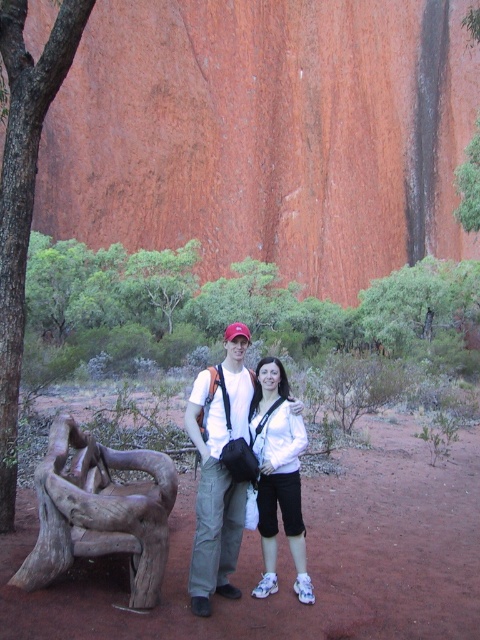
You are planning to take a photo of the smooth bark tree trunk at left and the white matte shirt at center. Which object should be placed closer to the camera to ensure both are in focus?

The smooth bark tree trunk at left is wider than the white matte shirt at center, so to ensure both are in focus, place the wider object closer to the camera.

You are a photographer planning to take a photo of the smooth bark tree trunk at left and the matte white shirt at center. Based on their heights, which object should you focus on first if you want to ensure both are in frame without moving the camera?

The smooth bark tree trunk at left is much taller than the matte white shirt at center, so you should focus on the smooth bark tree trunk at left first to ensure it fits within the frame, then adjust for the matte white shirt at center.